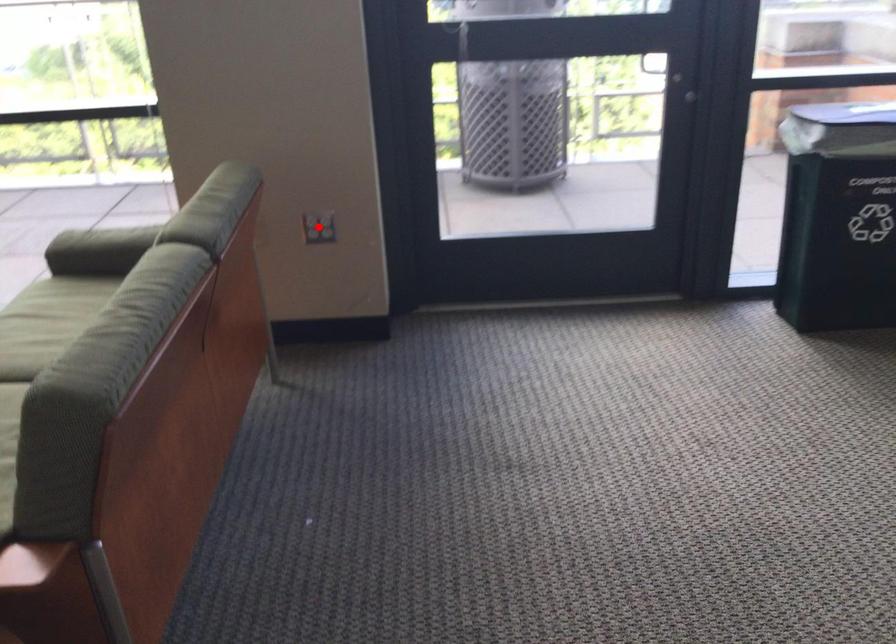
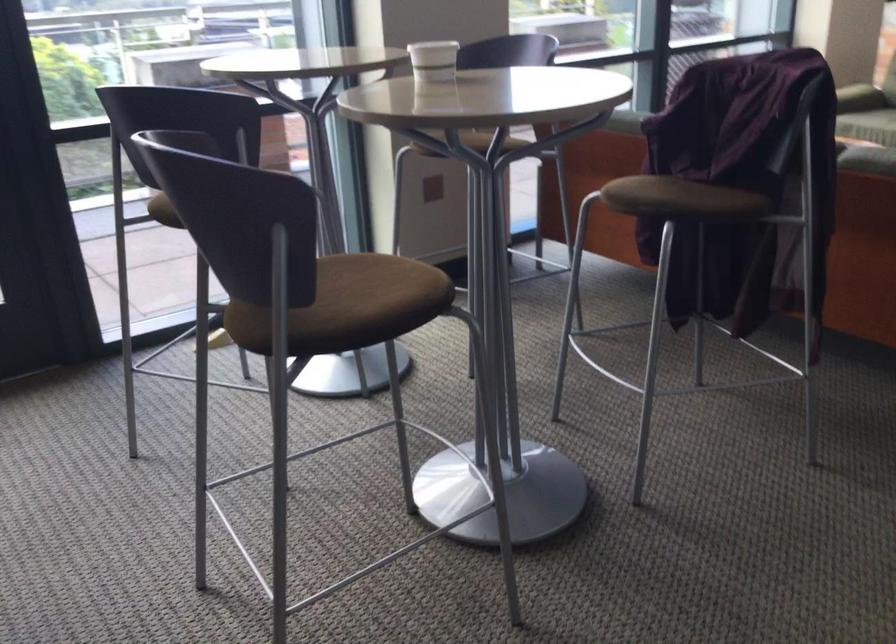
Question: I am providing you with two images of the same scene from different viewpoints. A red point is marked on the first image. Is the red point's position out of view in image 2?

Choices:
 (A) Yes
 (B) No

Answer: (A)